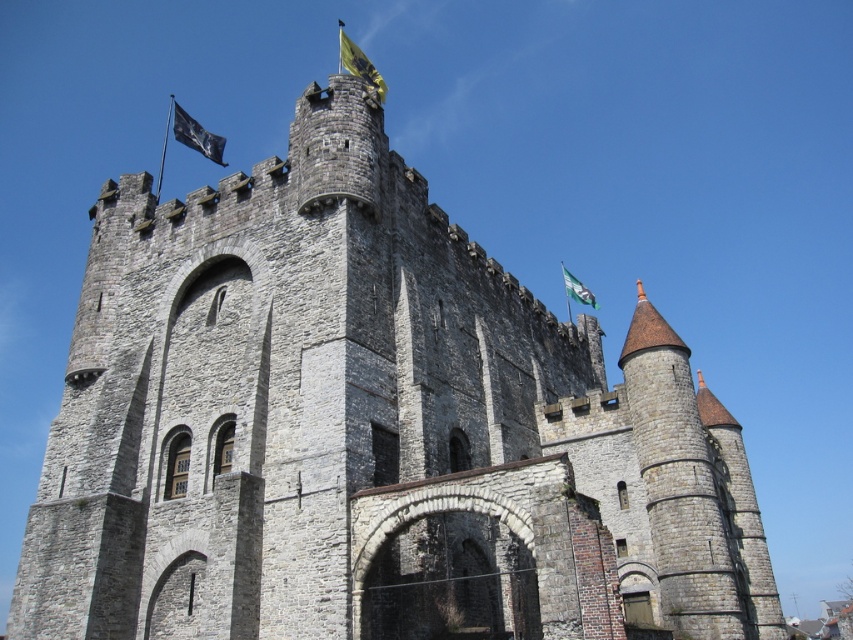
Question: Which of these objects is positioned farthest from the black fabric flag at upper left?

Choices:
 (A) yellow fabric flag at upper center
 (B) white fabric flag at upper right

Answer: (B)

Question: Which point appears farthest from the camera in this image?

Choices:
 (A) (181, 129)
 (B) (375, 77)
 (C) (567, 292)

Answer: (C)

Question: Can you confirm if yellow fabric flag at upper center is positioned below white fabric flag at upper right?

Choices:
 (A) yes
 (B) no

Answer: (B)

Question: Which point is closer to the camera?

Choices:
 (A) yellow fabric flag at upper center
 (B) black fabric flag at upper left
 (C) white fabric flag at upper right

Answer: (A)

Question: Is black fabric flag at upper left bigger than yellow fabric flag at upper center?

Choices:
 (A) yes
 (B) no

Answer: (A)

Question: Is black fabric flag at upper left wider than white fabric flag at upper right?

Choices:
 (A) yes
 (B) no

Answer: (A)